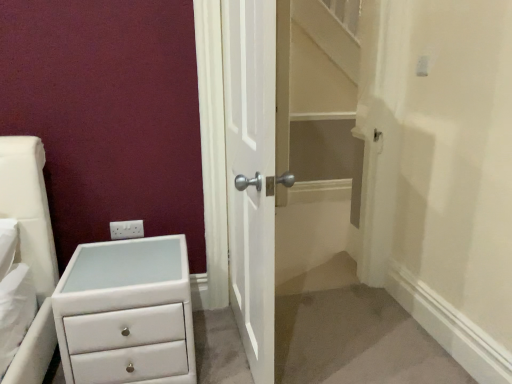
Question: Is the depth of white wooden door at center less than that of white plastic electric outlet at upper left?

Choices:
 (A) no
 (B) yes

Answer: (B)

Question: Is white wooden door at center shorter than white plastic electric outlet at upper left?

Choices:
 (A) yes
 (B) no

Answer: (B)

Question: Does white wooden door at center turn towards white plastic electric outlet at upper left?

Choices:
 (A) yes
 (B) no

Answer: (B)

Question: Is white wooden door at center taller than white plastic electric outlet at upper left?

Choices:
 (A) no
 (B) yes

Answer: (B)

Question: From the image's perspective, does white wooden door at center appear lower than white plastic electric outlet at upper left?

Choices:
 (A) no
 (B) yes

Answer: (A)

Question: Is the position of white wooden door at center more distant than that of white plastic electric outlet at upper left?

Choices:
 (A) yes
 (B) no

Answer: (B)

Question: From the image's perspective, would you say white plastic electric outlet at upper left is positioned over white wooden door at center?

Choices:
 (A) no
 (B) yes

Answer: (A)

Question: Is white plastic electric outlet at upper left to the left of white wooden door at center from the viewer's perspective?

Choices:
 (A) no
 (B) yes

Answer: (B)

Question: Are white plastic electric outlet at upper left and white wooden door at center beside each other?

Choices:
 (A) no
 (B) yes

Answer: (A)

Question: Is white plastic electric outlet at upper left facing towards white wooden door at center?

Choices:
 (A) yes
 (B) no

Answer: (B)

Question: Is white wooden door at center surrounded by white plastic electric outlet at upper left?

Choices:
 (A) no
 (B) yes

Answer: (A)

Question: From the image's perspective, is white plastic electric outlet at upper left below white wooden door at center?

Choices:
 (A) yes
 (B) no

Answer: (A)

Question: Does white glossy chest of drawers at lower left have a smaller size compared to white wooden door at center?

Choices:
 (A) no
 (B) yes

Answer: (B)